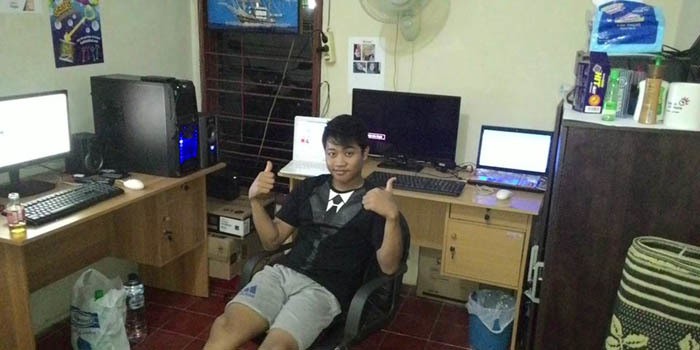
The width and height of the screenshot is (700, 350). I want to click on poster, so click(71, 50).